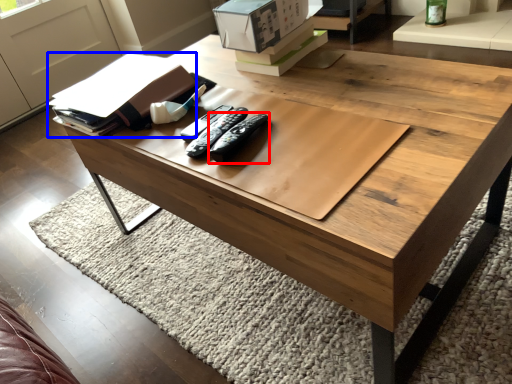
Question: Among these objects, which one is farthest to the camera, remote (highlighted by a red box) or book (highlighted by a blue box)?

Choices:
 (A) remote
 (B) book

Answer: (B)